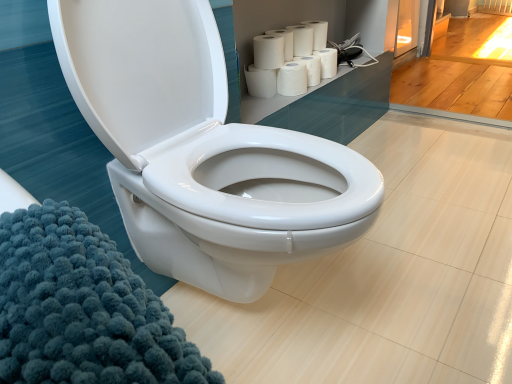
Question: Can you confirm if white matte paper towels at upper right, the third paper towel when ordered from top to bottom, is bigger than white matte toilet paper at upper right, arranged as the 1th toilet paper when ordered from the bottom?

Choices:
 (A) yes
 (B) no

Answer: (A)

Question: Is white matte paper towels at upper right, arranged as the fourth paper towel when ordered from the bottom, outside of white matte toilet paper at upper right, arranged as the 1th toilet paper when ordered from the bottom?

Choices:
 (A) yes
 (B) no

Answer: (A)

Question: From a real-world perspective, is white matte paper towels at upper right, arranged as the fourth paper towel when ordered from the bottom, positioned under white matte toilet paper at upper right, arranged as the 1th toilet paper when ordered from the bottom, based on gravity?

Choices:
 (A) no
 (B) yes

Answer: (A)

Question: Does white matte paper towels at upper right, the third paper towel when ordered from top to bottom, lie behind white matte toilet paper at upper right, which is the second toilet paper in top-to-bottom order?

Choices:
 (A) no
 (B) yes

Answer: (A)

Question: Considering the relative sizes of white matte paper towels at upper right, the third paper towel when ordered from top to bottom, and white matte toilet paper at upper right, arranged as the 1th toilet paper when ordered from the bottom, in the image provided, is white matte paper towels at upper right, the third paper towel when ordered from top to bottom, wider than white matte toilet paper at upper right, arranged as the 1th toilet paper when ordered from the bottom,?

Choices:
 (A) no
 (B) yes

Answer: (B)

Question: Can you confirm if white matte paper towels at upper right, the third paper towel when ordered from top to bottom, is thinner than white matte toilet paper at upper right, arranged as the 1th toilet paper when ordered from the bottom?

Choices:
 (A) yes
 (B) no

Answer: (B)

Question: Is white matte paper towel at upper center, placed as the 1th paper towel when sorted from top to bottom, shorter than white matte paper towels at upper right, the third paper towel when ordered from top to bottom?

Choices:
 (A) yes
 (B) no

Answer: (B)

Question: Is white matte paper towel at upper center, placed as the 1th paper towel when sorted from top to bottom, at the right side of white matte paper towels at upper right, arranged as the fourth paper towel when ordered from the bottom?

Choices:
 (A) yes
 (B) no

Answer: (A)

Question: Is white matte paper towel at upper center, which is the sixth paper towel from bottom to top, in front of white matte paper towels at upper right, arranged as the fourth paper towel when ordered from the bottom?

Choices:
 (A) no
 (B) yes

Answer: (A)

Question: Can you confirm if white matte paper towel at upper center, which is the sixth paper towel from bottom to top, is bigger than white matte paper towels at upper right, arranged as the fourth paper towel when ordered from the bottom?

Choices:
 (A) yes
 (B) no

Answer: (B)

Question: From the image's perspective, is white matte paper towel at upper center, which is the sixth paper towel from bottom to top, over white matte paper towels at upper right, the third paper towel when ordered from top to bottom?

Choices:
 (A) no
 (B) yes

Answer: (B)

Question: From a real-world perspective, is white matte paper towel at upper center, placed as the 1th paper towel when sorted from top to bottom, positioned over white matte paper towels at upper right, the third paper towel when ordered from top to bottom, based on gravity?

Choices:
 (A) yes
 (B) no

Answer: (A)

Question: Is white matte paper towel at upper right, the fourth paper towel positioned from the top, closer to the viewer compared to white matte toilet paper at upper right, which is the second toilet paper in top-to-bottom order?

Choices:
 (A) no
 (B) yes

Answer: (B)